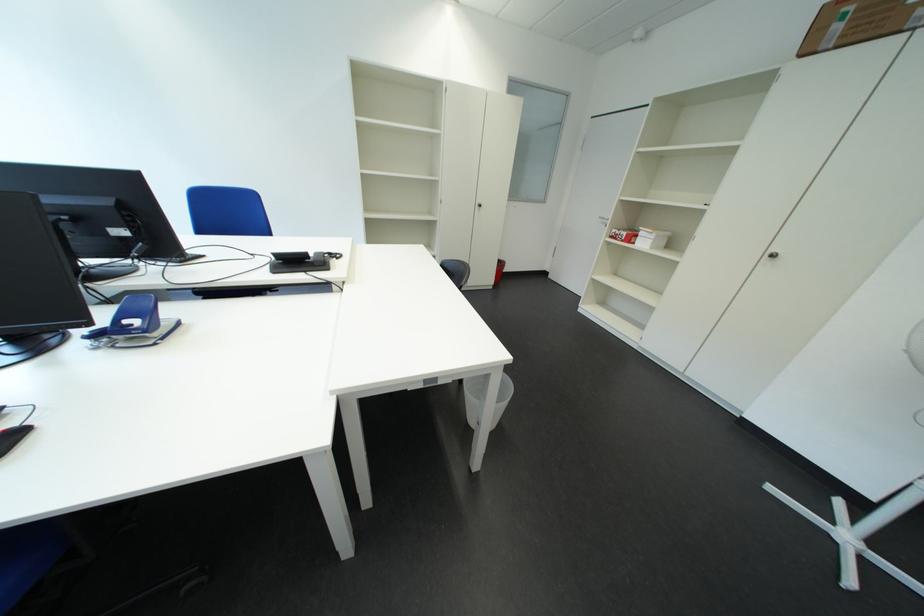
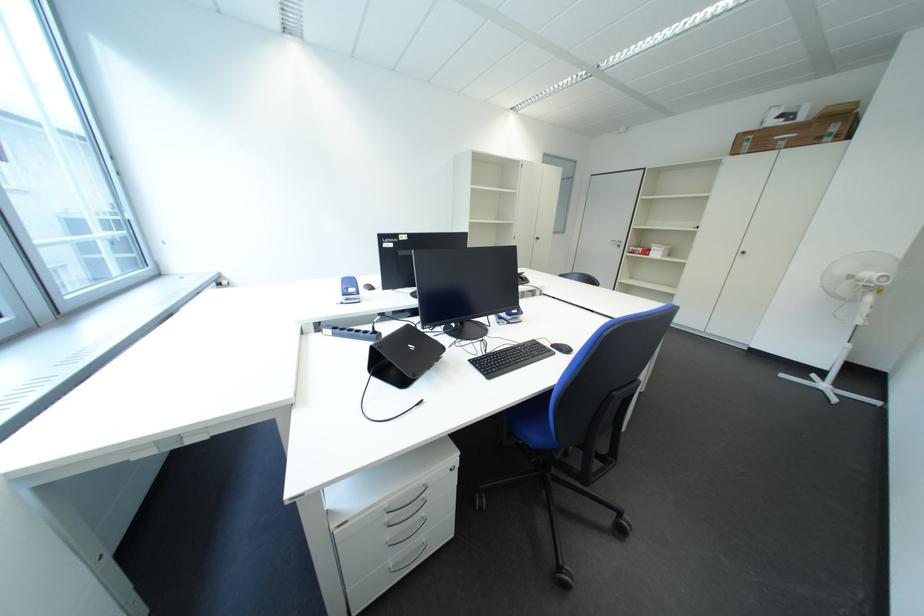
In a continuous first-person perspective shot, in which direction is the camera moving?

The cameraman walked toward left, backward.